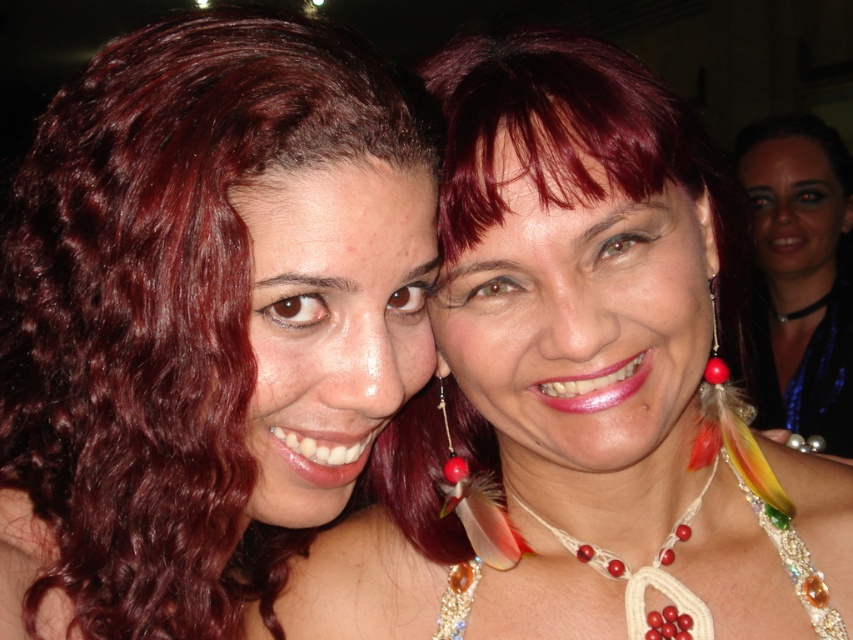
Does blue sequined dress at upper right appear under red glossy bead at ear?

Yes.

Between point (769, 346) and point (714, 372), which one is positioned in front?

Positioned in front is point (714, 372).

At what (x,y) coordinates should I click in order to perform the action: click on blue sequined dress at upper right. Please return your answer as a coordinate pair (x, y). The image size is (853, 640). Looking at the image, I should click on (805, 371).

In the scene shown: Does satin blue scarf at upper right have a lesser width compared to blue sequined dress at upper right?

Yes, satin blue scarf at upper right is thinner than blue sequined dress at upper right.

Where is `satin blue scarf at upper right`? satin blue scarf at upper right is located at coordinates (799, 275).

Based on the photo, can you confirm if shiny red hair at upper left is thinner than blue sequined dress at upper right?

Yes.

Which is behind, point (311, 262) or point (795, 371)?

The point (795, 371) is behind.

Locate an element on the screen. shiny red hair at upper left is located at coordinates (204, 320).